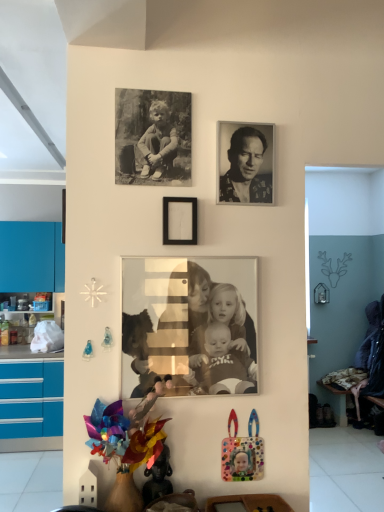
Question: Is polka dot plastic frame at lower right, the first toy when ordered from back to front, spatially inside sepia-toned photograph of family at center, marked as the first person in a bottom-to-top arrangement, or outside of it?

Choices:
 (A) outside
 (B) inside

Answer: (A)

Question: From the image's perspective, is polka dot plastic frame at lower right, which is the 2th toy in front-to-back order, positioned above or below sepia-toned photograph of family at center, marked as the first person in a bottom-to-top arrangement?

Choices:
 (A) above
 (B) below

Answer: (B)

Question: Estimate the real-world distances between objects in this image. Which object is farther from the shiny metallic figurine at center, which is counted as the 2th toy, starting from the right?

Choices:
 (A) black matte picture frame at center, marked as the 1th picture frame in a bottom-to-top arrangement
 (B) sepia-toned photograph of family at center, marked as the first person in a bottom-to-top arrangement
 (C) polka dot plastic frame at lower right, which ranks as the first toy in right-to-left order
 (D) black and white photograph of child at upper left, the first picture frame positioned from the top
 (E) multicolored plastic flower at lower left

Answer: (D)

Question: Estimate the real-world distances between objects in this image. Which object is farther from the multicolored plastic flower at lower left?

Choices:
 (A) shiny metallic figurine at center, placed as the first toy when sorted from left to right
 (B) sepia-toned photograph of family at center, the 2th person in the top-to-bottom sequence
 (C) polka dot plastic frame at lower right, which ranks as the first toy in right-to-left order
 (D) black and white photograph of a man at upper center, which appears as the first person when viewed from the top
 (E) black matte picture frame at center, which is counted as the second picture frame, starting from the top

Answer: (D)